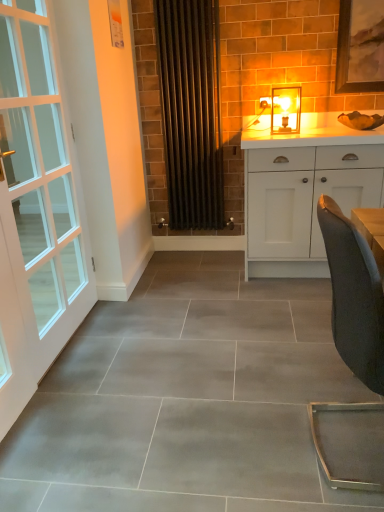
Question: Can you confirm if black metal radiator at center is wider than white matte cabinet at right?

Choices:
 (A) yes
 (B) no

Answer: (B)

Question: Are black metal radiator at center and white matte cabinet at right far apart?

Choices:
 (A) no
 (B) yes

Answer: (A)

Question: From the image's perspective, is black metal radiator at center over white matte cabinet at right?

Choices:
 (A) no
 (B) yes

Answer: (B)

Question: Does black metal radiator at center have a greater height compared to white matte cabinet at right?

Choices:
 (A) yes
 (B) no

Answer: (A)

Question: Is black metal radiator at center next to white matte cabinet at right and touching it?

Choices:
 (A) no
 (B) yes

Answer: (A)

Question: Is white matte cabinet at right bigger or smaller than white glass door at left?

Choices:
 (A) small
 (B) big

Answer: (B)

Question: Considering their positions, is white matte cabinet at right located in front of or behind white glass door at left?

Choices:
 (A) behind
 (B) front

Answer: (A)

Question: Is white matte cabinet at right inside the boundaries of white glass door at left, or outside?

Choices:
 (A) inside
 (B) outside

Answer: (B)

Question: In terms of height, does white matte cabinet at right look taller or shorter compared to white glass door at left?

Choices:
 (A) short
 (B) tall

Answer: (A)

Question: Is dark gray fabric chair at right bigger or smaller than white matte cabinet at right?

Choices:
 (A) small
 (B) big

Answer: (A)

Question: In terms of width, does dark gray fabric chair at right look wider or thinner when compared to white matte cabinet at right?

Choices:
 (A) wide
 (B) thin

Answer: (B)

Question: From the image's perspective, is dark gray fabric chair at right positioned above or below white matte cabinet at right?

Choices:
 (A) above
 (B) below

Answer: (B)

Question: In the image, is dark gray fabric chair at right positioned in front of or behind white matte cabinet at right?

Choices:
 (A) front
 (B) behind

Answer: (A)

Question: Based on their positions, is dark gray fabric chair at right located to the left or right of white glass door at left?

Choices:
 (A) left
 (B) right

Answer: (B)

Question: Is dark gray fabric chair at right in front of or behind white glass door at left in the image?

Choices:
 (A) front
 (B) behind

Answer: (A)